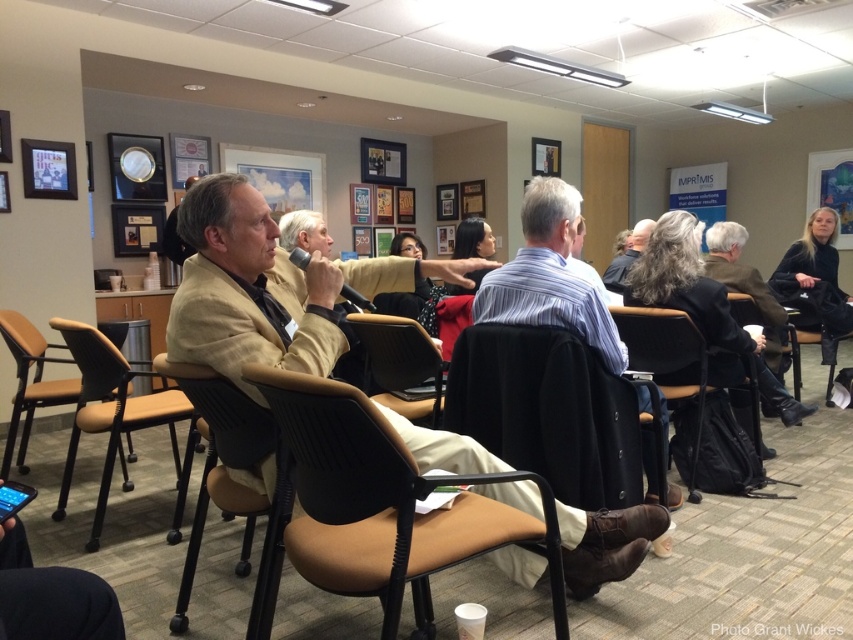
Question: Which point appears closest to the camera in this image?

Choices:
 (A) (544, 236)
 (B) (343, 564)
 (C) (238, 429)
 (D) (390, 337)

Answer: (B)

Question: Which point is farther to the camera?

Choices:
 (A) black leather chair at lower right
 (B) brown leather chair at center

Answer: (A)

Question: Is black plastic chair at center bigger than black leather chair at center?

Choices:
 (A) yes
 (B) no

Answer: (A)

Question: Which point appears closest to the camera in this image?

Choices:
 (A) (236, 216)
 (B) (51, 356)
 (C) (357, 403)

Answer: (C)

Question: Can you confirm if brown fabric chair at center is positioned above dark gray sweater at center?

Choices:
 (A) no
 (B) yes

Answer: (A)

Question: Does brown leather chair at left come in front of black leather chair at lower right?

Choices:
 (A) no
 (B) yes

Answer: (B)